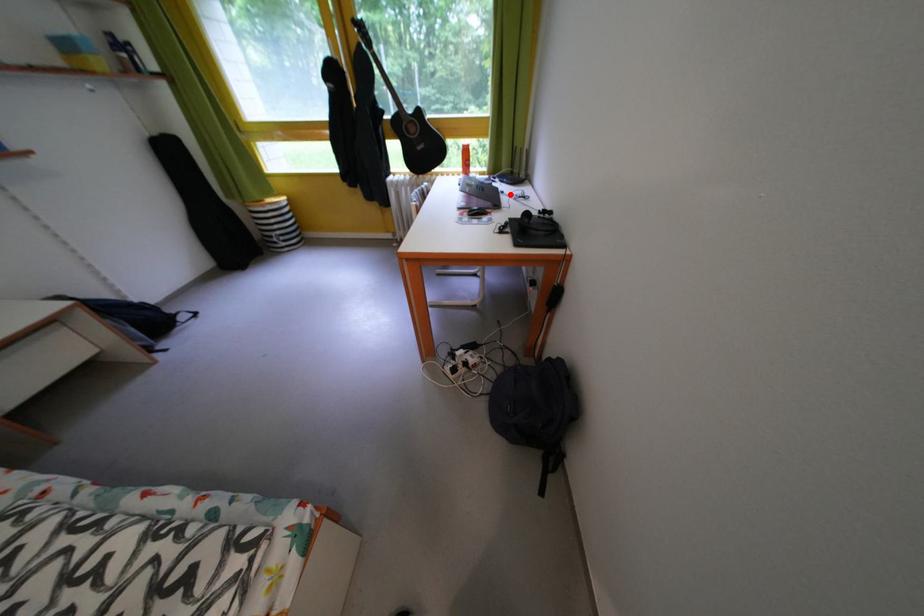
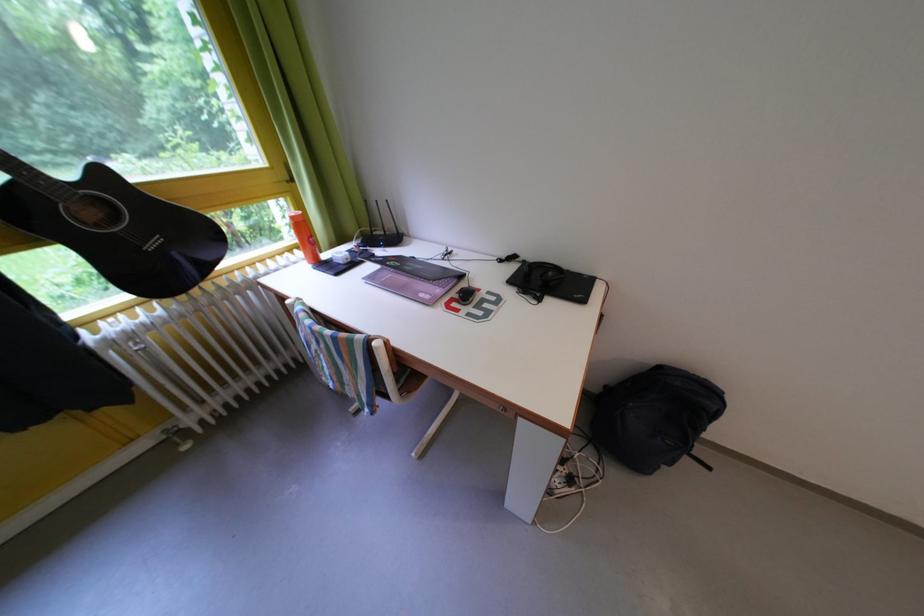
Question: I am providing you with two images of the same scene from different viewpoints. A red point is marked on the first image. Is the red point's position out of view in image 2?

Choices:
 (A) Yes
 (B) No

Answer: (B)